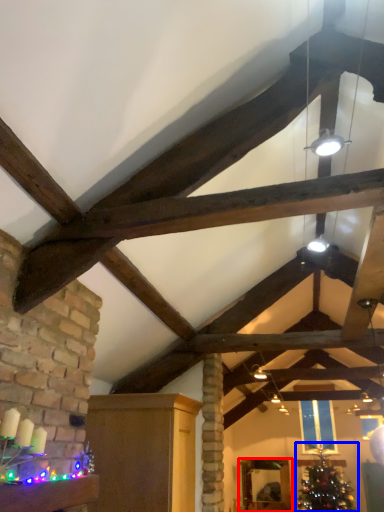
Question: Which of the following is the closest to the observer, furniture (highlighted by a red box) or christmas tree (highlighted by a blue box)?

Choices:
 (A) furniture
 (B) christmas tree

Answer: (B)